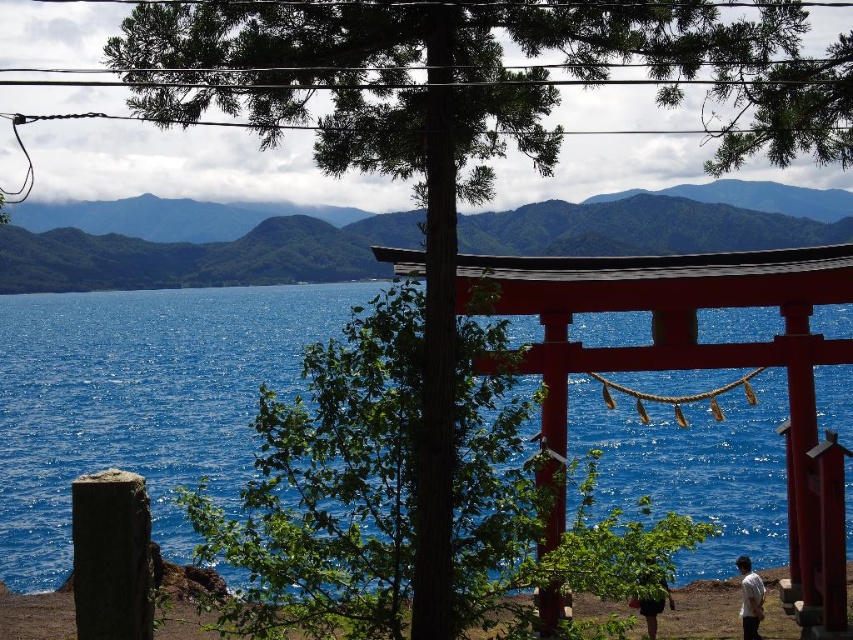
Question: Is white cotton shirt at lower right above green leafy hair at lower center?

Choices:
 (A) no
 (B) yes

Answer: (A)

Question: Is blue liquid water at center to the right of white cotton shirt at lower right from the viewer's perspective?

Choices:
 (A) yes
 (B) no

Answer: (B)

Question: Which of the following is the closest to the observer?

Choices:
 (A) blue liquid water at center
 (B) green leafy hair at lower center

Answer: (A)

Question: Where is white cotton shirt at lower right located in relation to green leafy hair at lower center in the image?

Choices:
 (A) below
 (B) above

Answer: (A)

Question: Which object is the farthest from the white cotton shirt at lower right?

Choices:
 (A) blue liquid water at center
 (B) green leafy hair at lower center

Answer: (A)

Question: Which of the following is the farthest from the observer?

Choices:
 (A) (637, 596)
 (B) (741, 579)
 (C) (726, 445)

Answer: (C)